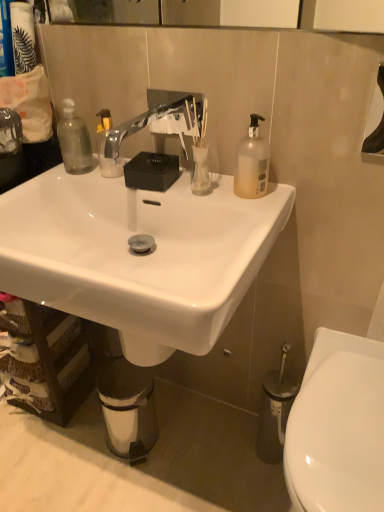
The width and height of the screenshot is (384, 512). I want to click on vacant space situated on the left part of metallic silver trash can at lower center, so click(x=74, y=439).